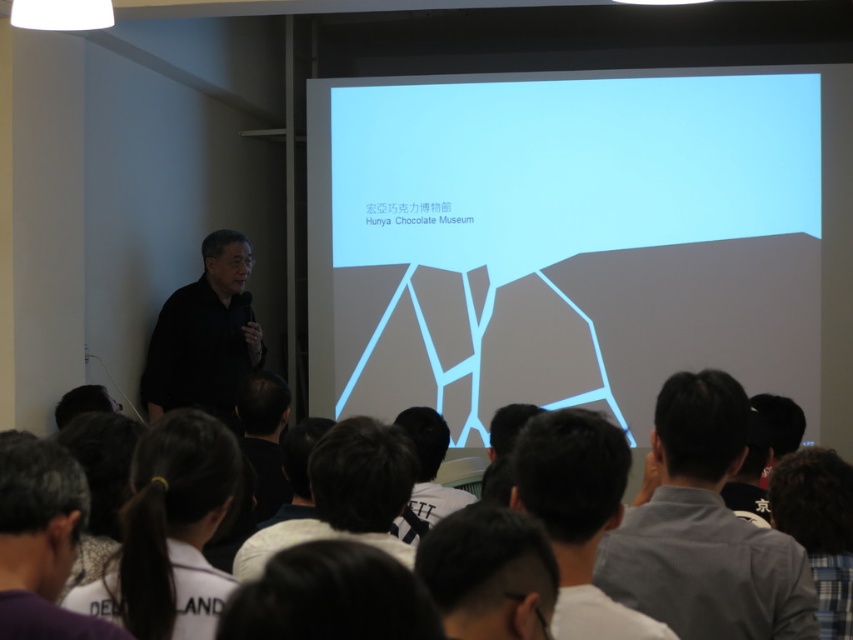
You are an attendee in the presentation. You want to know which object is shorter between the dark gray shirt at center and the dark brown hair at lower right. Can you tell me?

The dark gray shirt at center has a lesser height compared to dark brown hair at lower right, so the dark gray shirt at center is shorter.

You are organizing a presentation and need to decide where to place a new projector. The projector requires a space larger than the purple fabric at lower left. Is the dark gray shirt at center a suitable location for placing the projector?

The purple fabric at lower left is smaller than the dark gray shirt at center. Since the projector requires a space larger than the purple fabric at lower left, the dark gray shirt at center is suitable for placing the projector as it is larger.

You are sitting in the audience of the presentation about the Hunya Chocolate Museum. You notice two elements in the front area where the speaker is standing. One is the dark gray shirt at center and the other is the dark brown hair at lower right. From your perspective, which of these two elements is positioned higher up in the image?

The dark gray shirt at center is positioned higher up in the image because it is above the dark brown hair at lower right.